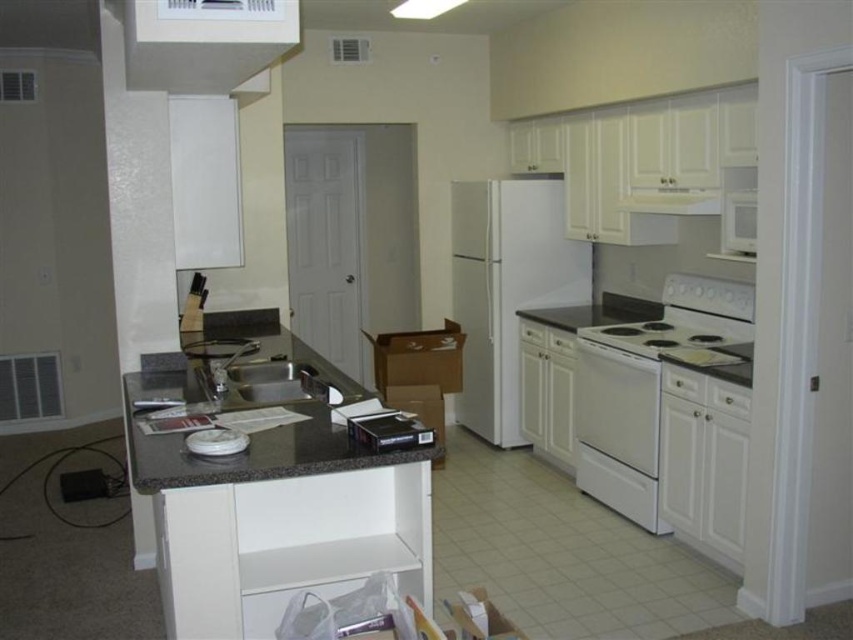
You are standing in the kitchen and need to locate the white glossy exhaust hood at upper center. According to the coordinates provided, where exactly is it positioned in the image?

The white glossy exhaust hood at upper center is located at coordinates point (204, 42).

You are standing in the kitchen and want to reach both the white glossy exhaust hood at upper center and the white glossy oven at lower right. Which appliance will you need to move towards first?

You will need to move towards the white glossy exhaust hood at upper center first because it is closer to you than the white glossy oven at lower right, which is further away.